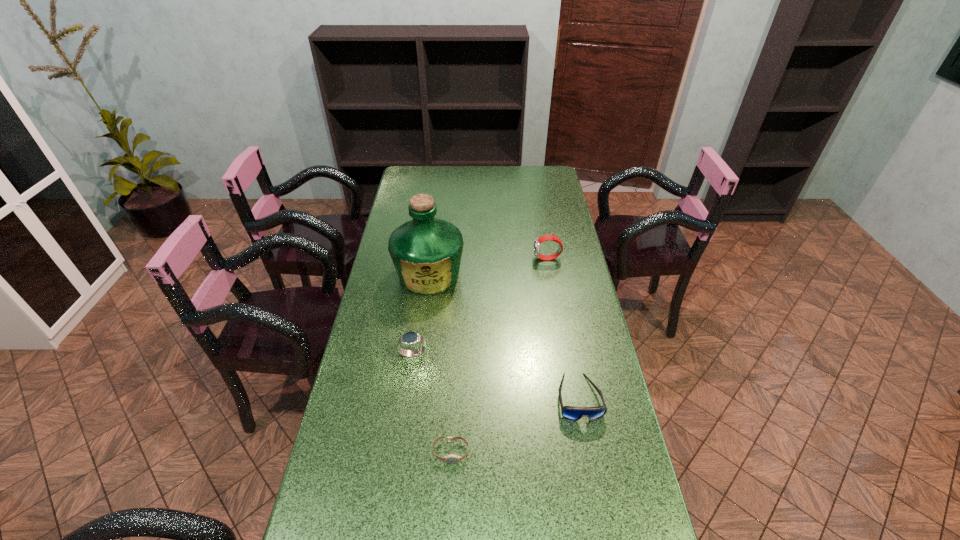
Locate an element on the screen. The height and width of the screenshot is (540, 960). free location that satisfies the following two spatial constraints: 1. on the face of the tallest watch; 2. on the label side of the liquor is located at coordinates (550, 275).

What are the coordinates of `vacant region that satisfies the following two spatial constraints: 1. on the face of the farthest watch; 2. on the front side of the second tallest watch` in the screenshot? It's located at (564, 354).